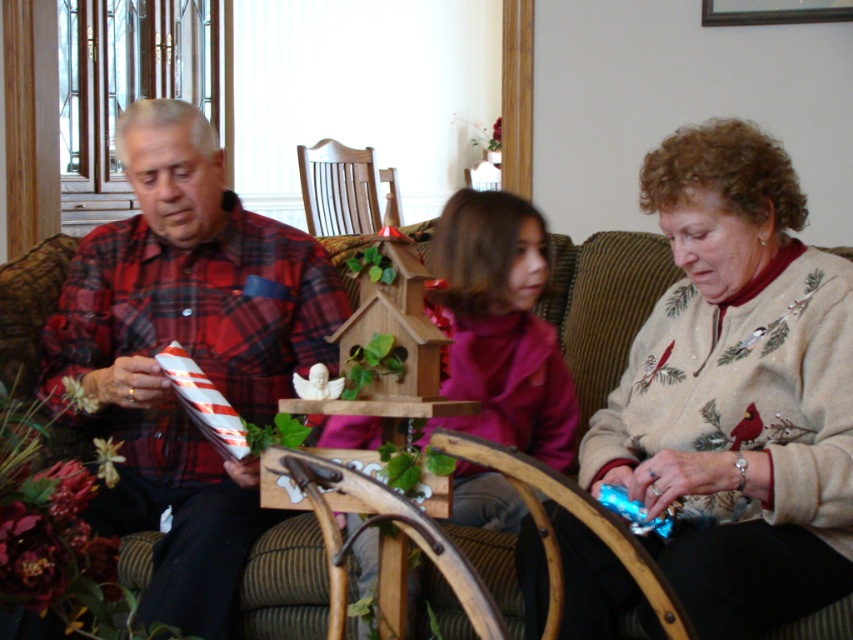
Question: Among these objects, which one is nearest to the camera?

Choices:
 (A) brown fabric couch at center
 (B) beige embroidered sweater at right
 (C) red plaid shirt at left

Answer: (B)

Question: Considering the real-world distances, which object is farthest from the wooden rocking chair at center?

Choices:
 (A) red plaid shirt at left
 (B) brown fabric couch at center

Answer: (A)

Question: Can you confirm if brown fabric couch at center is positioned below wooden rocking chair at center?

Choices:
 (A) yes
 (B) no

Answer: (A)

Question: From the image, what is the correct spatial relationship of beige embroidered sweater at right in relation to brown fabric couch at center?

Choices:
 (A) above
 (B) below

Answer: (B)

Question: Estimate the real-world distances between objects in this image. Which object is closer to the wooden rocking chair at center?

Choices:
 (A) red plaid shirt at left
 (B) brown fabric couch at center

Answer: (B)

Question: Does brown fabric couch at center come behind wooden rocking chair at center?

Choices:
 (A) yes
 (B) no

Answer: (B)